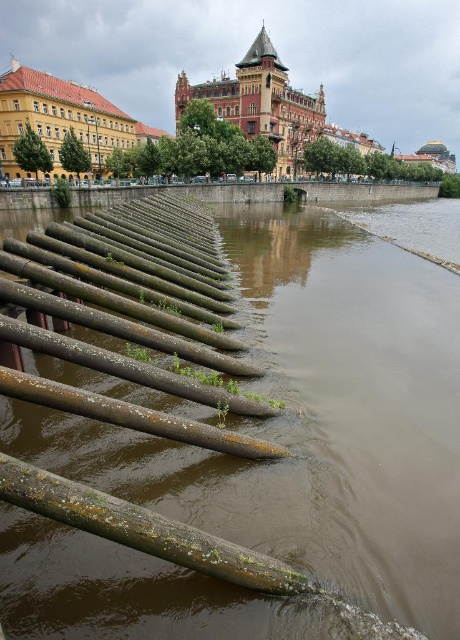
Image resolution: width=460 pixels, height=640 pixels. Describe the element at coordinates (314, 419) in the screenshot. I see `brown concrete river at lower left` at that location.

Does brown concrete river at lower left have a lesser width compared to green mossy log at lower left?

No.

Describe the element at coordinates (314, 419) in the screenshot. The image size is (460, 640). I see `brown concrete river at lower left` at that location.

Locate an element on the screen. The height and width of the screenshot is (640, 460). brown concrete river at lower left is located at coordinates (314, 419).